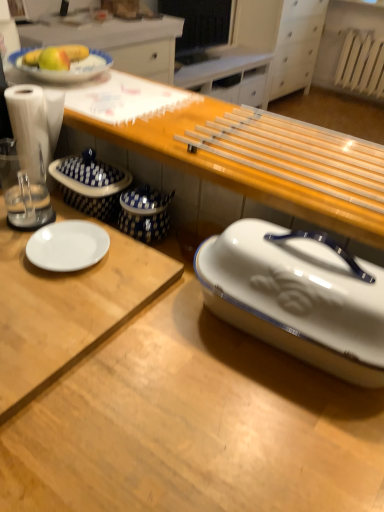
Identify the location of vacant space situated above white glossy desk at center, which is counted as the first desk, starting from the bottom (from a real-world perspective). This screenshot has height=512, width=384. (91, 242).